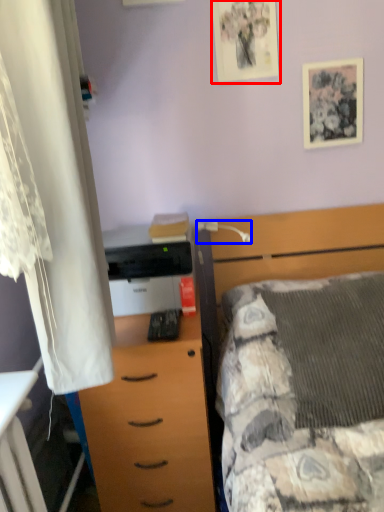
Question: Which object is further to the camera taking this photo, picture frame (highlighted by a red box) or lamp (highlighted by a blue box)?

Choices:
 (A) picture frame
 (B) lamp

Answer: (A)